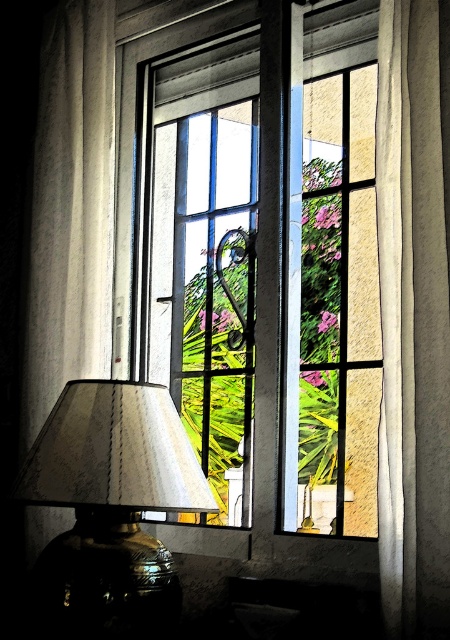
Question: Estimate the real-world distances between objects in this image. Which object is closer to the white textured curtain at right?

Choices:
 (A) matte silver lampshade at lower left
 (B) clear glass window at center

Answer: (A)

Question: Can you confirm if clear glass window at center is positioned below matte silver lampshade at lower left?

Choices:
 (A) yes
 (B) no

Answer: (B)

Question: Estimate the real-world distances between objects in this image. Which object is closer to the matte silver lampshade at lower left?

Choices:
 (A) white textured curtain at right
 (B) clear glass window at center

Answer: (A)

Question: Considering the relative positions of clear glass window at center and white textured curtain at right in the image provided, where is clear glass window at center located with respect to white textured curtain at right?

Choices:
 (A) left
 (B) right

Answer: (A)

Question: Is matte silver lampshade at lower left to the left of white textured curtain at right from the viewer's perspective?

Choices:
 (A) no
 (B) yes

Answer: (B)

Question: Which point is closer to the camera?

Choices:
 (A) (396, 49)
 (B) (94, 403)

Answer: (B)